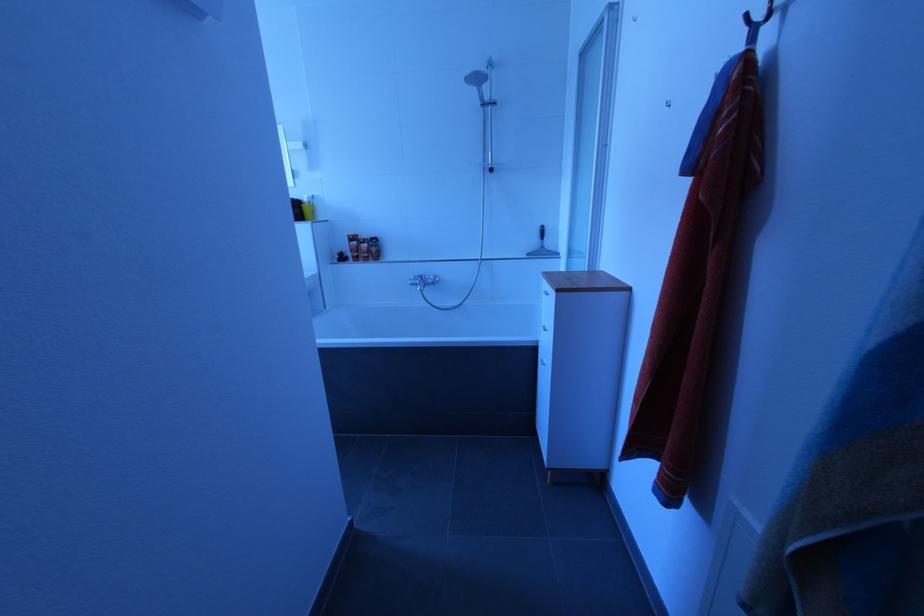
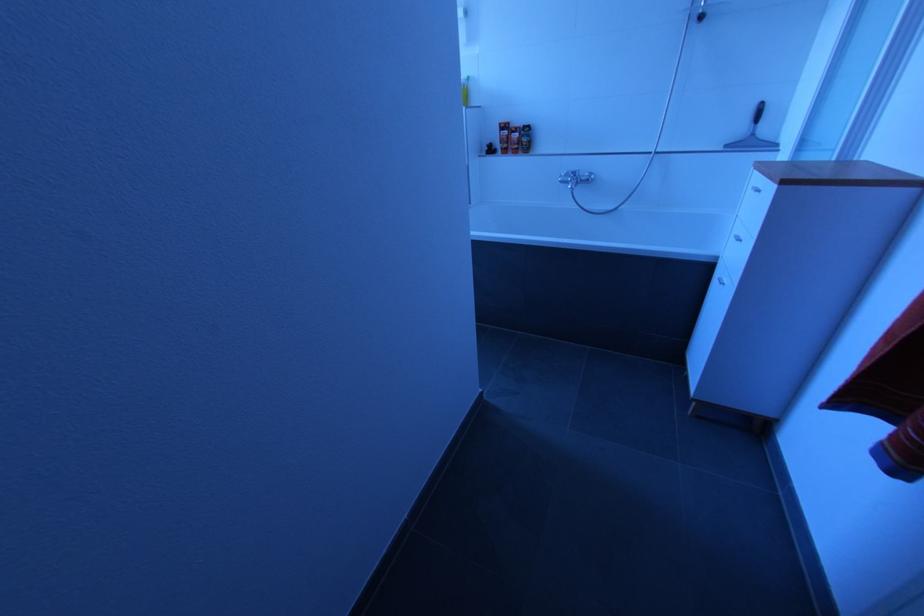
Question: In a continuous first-person perspective shot, in which direction is the camera moving?

Choices:
 (A) Left
 (B) Right
 (C) Forward
 (D) Backward

Answer: (A)